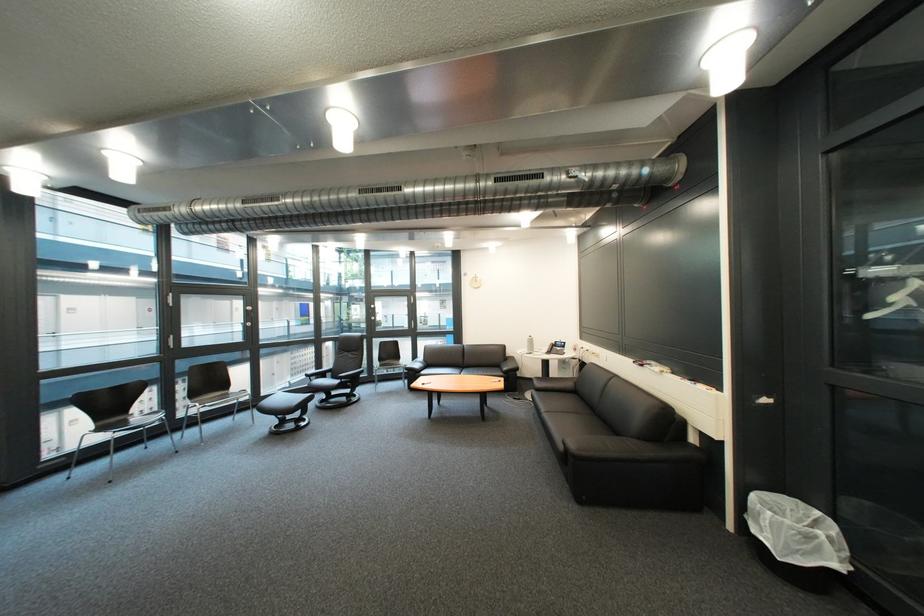
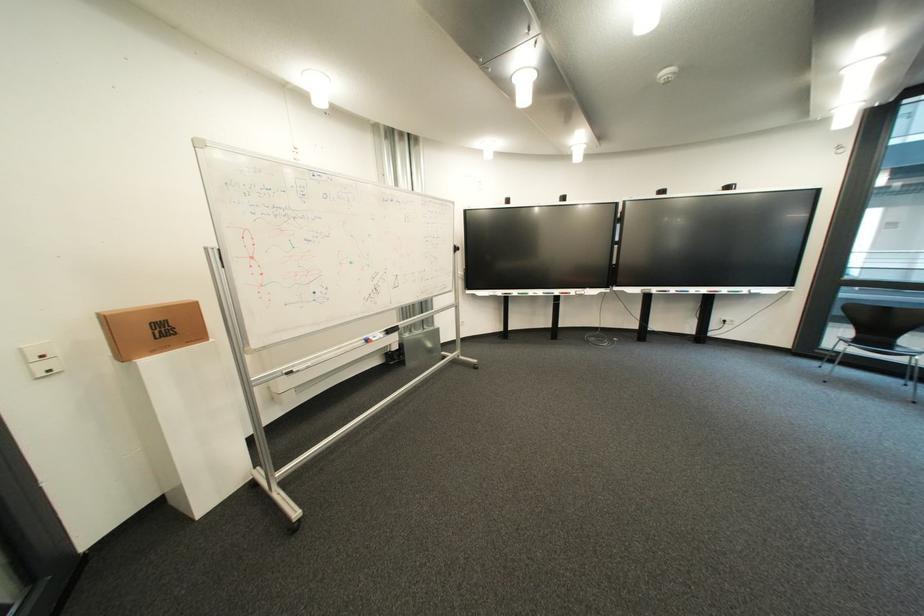
The point at (114, 431) is marked in the first image. Where is the corresponding point in the second image?

(870, 342)